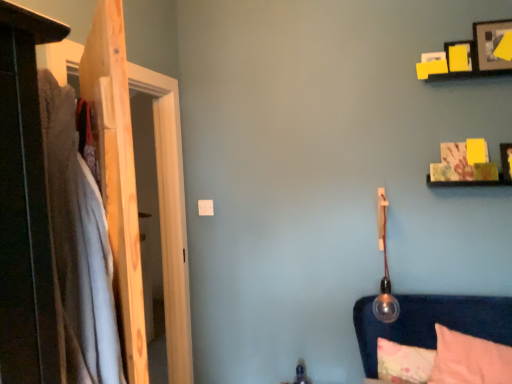
Where is `soft cotton blanket at left`? Image resolution: width=512 pixels, height=384 pixels. soft cotton blanket at left is located at coordinates (79, 243).

The image size is (512, 384). What do you see at coordinates (403, 362) in the screenshot?
I see `fluffy pink pillow at lower right, which is the second pillow in front-to-back order` at bounding box center [403, 362].

The image size is (512, 384). What do you see at coordinates (117, 172) in the screenshot?
I see `wooden door at left` at bounding box center [117, 172].

Image resolution: width=512 pixels, height=384 pixels. Identify the location of yellow paper picture frame at upper right, the second picture frame when ordered from bottom to top. (459, 56).

This screenshot has height=384, width=512. Identify the location of wooden picture frame at upper right, which is the 1th picture frame from bottom to top. (506, 160).

Considering the relative sizes of yellow paper picture frame at upper right, the second picture frame when ordered from bottom to top, and wooden door at left in the image provided, is yellow paper picture frame at upper right, the second picture frame when ordered from bottom to top, taller than wooden door at left?

Incorrect, the height of yellow paper picture frame at upper right, the second picture frame when ordered from bottom to top, is not larger of that of wooden door at left.

Where is `door in front of the yellow paper picture frame at upper right, the second picture frame when ordered from bottom to top`? Image resolution: width=512 pixels, height=384 pixels. door in front of the yellow paper picture frame at upper right, the second picture frame when ordered from bottom to top is located at coordinates (117, 172).

Is yellow paper picture frame at upper right, the second picture frame when ordered from bottom to top, wider or thinner than wooden door at left?

yellow paper picture frame at upper right, the second picture frame when ordered from bottom to top, is thinner than wooden door at left.

Considering the sizes of yellow paper picture frame at upper right, marked as the second picture frame in a top-to-bottom arrangement, and wooden door at left in the image, is yellow paper picture frame at upper right, marked as the second picture frame in a top-to-bottom arrangement, bigger or smaller than wooden door at left?

In the image, yellow paper picture frame at upper right, marked as the second picture frame in a top-to-bottom arrangement, appears to be smaller than wooden door at left.

Is wooden door at left at the left side of pink soft pillow at lower right, which ranks as the 2th pillow in back-to-front order?

Result: Yes.

Based on the photo, is there a large distance between wooden door at left and pink soft pillow at lower right, the first pillow in the front-to-back sequence?

That's right, there is a large distance between wooden door at left and pink soft pillow at lower right, the first pillow in the front-to-back sequence.

Consider the image. Considering the relative positions of wooden door at left and pink soft pillow at lower right, the first pillow in the front-to-back sequence, in the image provided, is wooden door at left behind pink soft pillow at lower right, the first pillow in the front-to-back sequence,?

No.

From the picture: Measure the distance between soft cotton blanket at left and yellow paper picture frame at upper right, marked as the second picture frame in a top-to-bottom arrangement.

soft cotton blanket at left and yellow paper picture frame at upper right, marked as the second picture frame in a top-to-bottom arrangement, are 5.70 feet apart.

In the scene shown: Would you consider soft cotton blanket at left to be distant from yellow paper picture frame at upper right, the second picture frame when ordered from bottom to top?

soft cotton blanket at left is positioned a significant distance from yellow paper picture frame at upper right, the second picture frame when ordered from bottom to top.

Can you confirm if soft cotton blanket at left is bigger than yellow paper picture frame at upper right, marked as the second picture frame in a top-to-bottom arrangement?

Yes.

Is soft cotton blanket at left facing towards yellow paper picture frame at upper right, the second picture frame when ordered from bottom to top?

No, soft cotton blanket at left does not turn towards yellow paper picture frame at upper right, the second picture frame when ordered from bottom to top.

Is wooden picture frame at upper right, the third picture frame ordered from the bottom, not near fluffy pink pillow at lower right, which is counted as the first pillow, starting from the back?

Yes, wooden picture frame at upper right, the third picture frame ordered from the bottom, is far from fluffy pink pillow at lower right, which is counted as the first pillow, starting from the back.

Does wooden picture frame at upper right, the 1th picture frame when ordered from top to bottom, have a smaller size compared to fluffy pink pillow at lower right, which is counted as the first pillow, starting from the back?

Indeed, wooden picture frame at upper right, the 1th picture frame when ordered from top to bottom, has a smaller size compared to fluffy pink pillow at lower right, which is counted as the first pillow, starting from the back.

Could you measure the distance between wooden picture frame at upper right, the third picture frame ordered from the bottom, and fluffy pink pillow at lower right, which is the second pillow in front-to-back order?

wooden picture frame at upper right, the third picture frame ordered from the bottom, is 1.37 meters away from fluffy pink pillow at lower right, which is the second pillow in front-to-back order.

From the image's perspective, is wooden picture frame at upper right, the 1th picture frame when ordered from top to bottom, located above or below fluffy pink pillow at lower right, which is the second pillow in front-to-back order?

Clearly, from the image's perspective, wooden picture frame at upper right, the 1th picture frame when ordered from top to bottom, is above fluffy pink pillow at lower right, which is the second pillow in front-to-back order.

Consider the image. Who is bigger, yellow paper picture frame at upper right, the second picture frame when ordered from bottom to top, or soft cotton blanket at left?

soft cotton blanket at left.

How many degrees apart are the facing directions of yellow paper picture frame at upper right, the second picture frame when ordered from bottom to top, and soft cotton blanket at left?

yellow paper picture frame at upper right, the second picture frame when ordered from bottom to top, and soft cotton blanket at left are facing 37.7 degrees away from each other.

Who is taller, yellow paper picture frame at upper right, the second picture frame when ordered from bottom to top, or soft cotton blanket at left?

Standing taller between the two is soft cotton blanket at left.

Is yellow paper picture frame at upper right, the second picture frame when ordered from bottom to top, turned away from soft cotton blanket at left?

No, yellow paper picture frame at upper right, the second picture frame when ordered from bottom to top, is not facing away from soft cotton blanket at left.

Considering the sizes of wooden door at left and fluffy pink pillow at lower right, which is the second pillow in front-to-back order, in the image, is wooden door at left bigger or smaller than fluffy pink pillow at lower right, which is the second pillow in front-to-back order,?

wooden door at left is bigger than fluffy pink pillow at lower right, which is the second pillow in front-to-back order.

From the image's perspective, between wooden door at left and fluffy pink pillow at lower right, which is the second pillow in front-to-back order, which one is located above?

wooden door at left.

Can we say wooden door at left lies outside fluffy pink pillow at lower right, which is the second pillow in front-to-back order?

That's correct, wooden door at left is outside of fluffy pink pillow at lower right, which is the second pillow in front-to-back order.

Considering the relative sizes of yellow paper picture frame at upper right, the second picture frame when ordered from bottom to top, and fluffy pink pillow at lower right, which is counted as the first pillow, starting from the back, in the image provided, is yellow paper picture frame at upper right, the second picture frame when ordered from bottom to top, wider than fluffy pink pillow at lower right, which is counted as the first pillow, starting from the back,?

Incorrect, the width of yellow paper picture frame at upper right, the second picture frame when ordered from bottom to top, does not surpass that of fluffy pink pillow at lower right, which is counted as the first pillow, starting from the back.

Based on the photo, which is in front, yellow paper picture frame at upper right, marked as the second picture frame in a top-to-bottom arrangement, or fluffy pink pillow at lower right, which is the second pillow in front-to-back order?

fluffy pink pillow at lower right, which is the second pillow in front-to-back order.

Is yellow paper picture frame at upper right, marked as the second picture frame in a top-to-bottom arrangement, aimed at fluffy pink pillow at lower right, which is the second pillow in front-to-back order?

No, yellow paper picture frame at upper right, marked as the second picture frame in a top-to-bottom arrangement, is not oriented towards fluffy pink pillow at lower right, which is the second pillow in front-to-back order.

Does yellow paper picture frame at upper right, marked as the second picture frame in a top-to-bottom arrangement, have a smaller size compared to fluffy pink pillow at lower right, which is the second pillow in front-to-back order?

Indeed, yellow paper picture frame at upper right, marked as the second picture frame in a top-to-bottom arrangement, has a smaller size compared to fluffy pink pillow at lower right, which is the second pillow in front-to-back order.

Locate an element on the screen. This screenshot has height=384, width=512. door below the yellow paper picture frame at upper right, the second picture frame when ordered from bottom to top (from the image's perspective) is located at coordinates (117, 172).

At what (x,y) coordinates should I click in order to perform the action: click on door on the left of pink soft pillow at lower right, the first pillow in the front-to-back sequence. Please return your answer as a coordinate pair (x, y). This screenshot has height=384, width=512. Looking at the image, I should click on (117, 172).

When comparing their distances from soft cotton blanket at left, does yellow paper picture frame at upper right, marked as the second picture frame in a top-to-bottom arrangement, or wooden picture frame at upper right, the 1th picture frame when ordered from top to bottom, seem closer?

yellow paper picture frame at upper right, marked as the second picture frame in a top-to-bottom arrangement, is positioned closer to the anchor soft cotton blanket at left.

Considering their positions, is fluffy pink pillow at lower right, which is the second pillow in front-to-back order, positioned closer to pink soft pillow at lower right, which ranks as the 2th pillow in back-to-front order, than yellow paper picture frame at upper right, the second picture frame when ordered from bottom to top?

fluffy pink pillow at lower right, which is the second pillow in front-to-back order, is closer to pink soft pillow at lower right, which ranks as the 2th pillow in back-to-front order.

Based on their spatial positions, is wooden picture frame at upper right, the 1th picture frame when ordered from top to bottom, or soft cotton blanket at left further from wooden picture frame at upper right, which is the 1th picture frame from bottom to top?

soft cotton blanket at left is further to wooden picture frame at upper right, which is the 1th picture frame from bottom to top.

From the image, which object appears to be nearer to pink soft pillow at lower right, the first pillow in the front-to-back sequence, wooden picture frame at upper right, which is the 1th picture frame from bottom to top, or yellow paper picture frame at upper right, marked as the second picture frame in a top-to-bottom arrangement?

wooden picture frame at upper right, which is the 1th picture frame from bottom to top, lies closer to pink soft pillow at lower right, the first pillow in the front-to-back sequence, than the other object.

When comparing their distances from fluffy pink pillow at lower right, which is the second pillow in front-to-back order, does wooden door at left or wooden picture frame at upper right, the third picture frame ordered from the bottom, seem closer?

Based on the image, wooden picture frame at upper right, the third picture frame ordered from the bottom, appears to be nearer to fluffy pink pillow at lower right, which is the second pillow in front-to-back order.

When comparing their distances from wooden door at left, does fluffy pink pillow at lower right, which is the second pillow in front-to-back order, or wooden picture frame at upper right, the 3th picture frame positioned from the top, seem further?

wooden picture frame at upper right, the 3th picture frame positioned from the top.

Estimate the real-world distances between objects in this image. Which object is further from pink soft pillow at lower right, which ranks as the 2th pillow in back-to-front order, yellow paper picture frame at upper right, the second picture frame when ordered from bottom to top, or soft cotton blanket at left?

soft cotton blanket at left.

From the image, which object appears to be nearer to yellow paper picture frame at upper right, marked as the second picture frame in a top-to-bottom arrangement, wooden door at left or fluffy pink pillow at lower right, which is counted as the first pillow, starting from the back?

fluffy pink pillow at lower right, which is counted as the first pillow, starting from the back, is positioned closer to the anchor yellow paper picture frame at upper right, marked as the second picture frame in a top-to-bottom arrangement.

I want to click on door located between soft cotton blanket at left and fluffy pink pillow at lower right, which is the second pillow in front-to-back order, in the depth direction, so click(117, 172).

Where is `pillow between wooden picture frame at upper right, which is the 1th picture frame from bottom to top, and fluffy pink pillow at lower right, which is counted as the first pillow, starting from the back, in the up-down direction`? This screenshot has width=512, height=384. pillow between wooden picture frame at upper right, which is the 1th picture frame from bottom to top, and fluffy pink pillow at lower right, which is counted as the first pillow, starting from the back, in the up-down direction is located at coordinates (469, 360).

Where is `blanket between wooden door at left and wooden picture frame at upper right, which is the 1th picture frame from bottom to top`? This screenshot has width=512, height=384. blanket between wooden door at left and wooden picture frame at upper right, which is the 1th picture frame from bottom to top is located at coordinates [79, 243].

You are a GUI agent. You are given a task and a screenshot of the screen. Output one action in this format:
    pyautogui.click(x=<x>, y=<y>)
    Task: Click on the blanket that lies between yellow paper picture frame at upper right, marked as the second picture frame in a top-to-bottom arrangement, and fluffy pink pillow at lower right, which is counted as the first pillow, starting from the back, from top to bottom
    This screenshot has height=384, width=512.
    Given the screenshot: What is the action you would take?
    pyautogui.click(x=79, y=243)